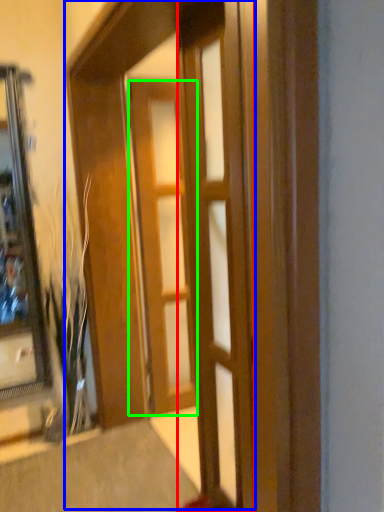
Question: Which object is the closest to the door (highlighted by a red box)? Choose among these: barn door (highlighted by a blue box) or door (highlighted by a green box).

Choices:
 (A) barn door
 (B) door

Answer: (A)